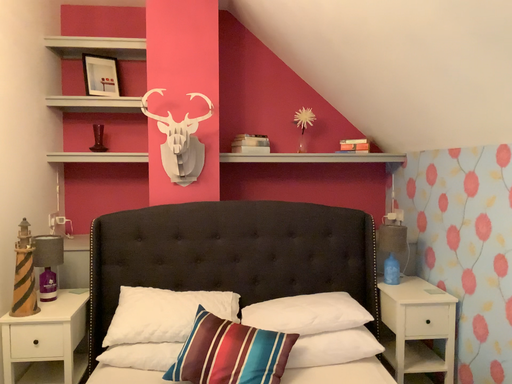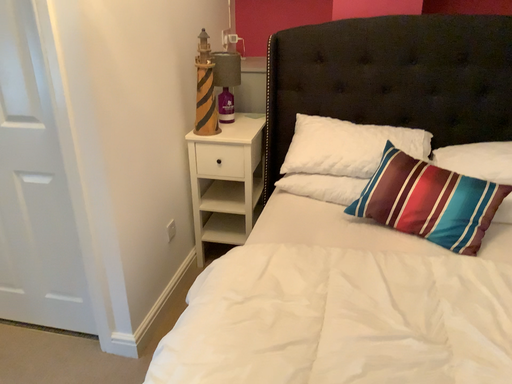
Question: How did the camera likely rotate when shooting the video?

Choices:
 (A) rotated upward
 (B) rotated downward

Answer: (B)